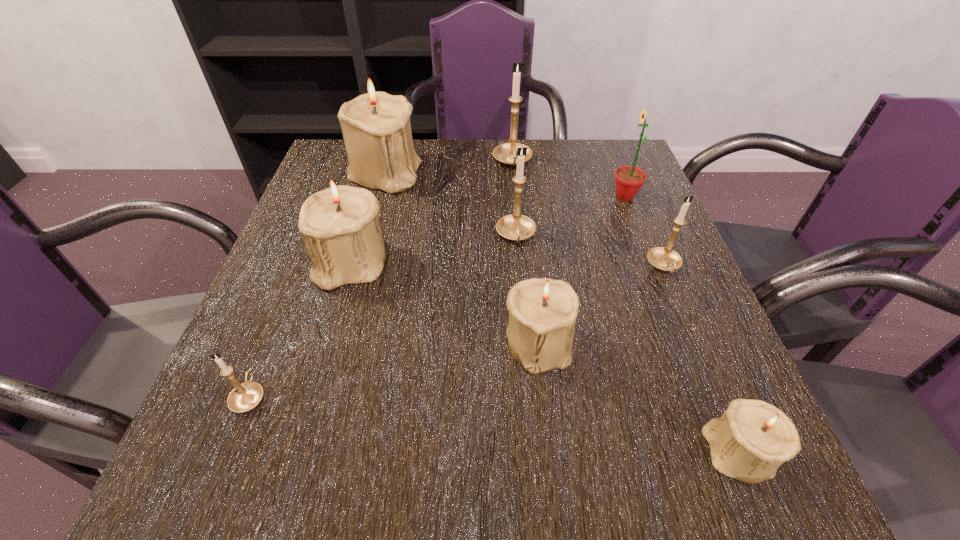
Identify the location of the nearest beige candle_holder. (752, 439).

This screenshot has height=540, width=960. Identify the location of the nearest object. tap(752, 439).

Where is `free point located on the handle side of the farthest gold candle holder`? Image resolution: width=960 pixels, height=540 pixels. free point located on the handle side of the farthest gold candle holder is located at coordinates (518, 226).

The image size is (960, 540). Identify the location of free location located 0.070m on the back of the farthest beige candle_holder. (394, 141).

Identify the location of vacant space located on the face of the sunflower. The image size is (960, 540). (561, 196).

You are a GUI agent. You are given a task and a screenshot of the screen. Output one action in this format:
    pyautogui.click(x=<x>, y=<y>)
    Task: Click on the vacant region located on the face of the sunflower
    
    Given the screenshot: What is the action you would take?
    pyautogui.click(x=487, y=196)

Find the location of a particular element. The height and width of the screenshot is (540, 960). vacant space located 0.390m on the face of the sunflower is located at coordinates (449, 196).

Find the location of a particular element. Image resolution: width=960 pixels, height=540 pixels. vacant position located 0.110m on the handle side of the second biggest gold candle holder is located at coordinates (521, 293).

Image resolution: width=960 pixels, height=540 pixels. I want to click on vacant area situated on the left of the second biggest beige candle_holder, so click(x=293, y=264).

At what (x,y) coordinates should I click in order to perform the action: click on free space located 0.050m on the handle side of the second smallest gold candle holder. Please return your answer as a coordinate pair (x, y). The width and height of the screenshot is (960, 540). Looking at the image, I should click on point(679,302).